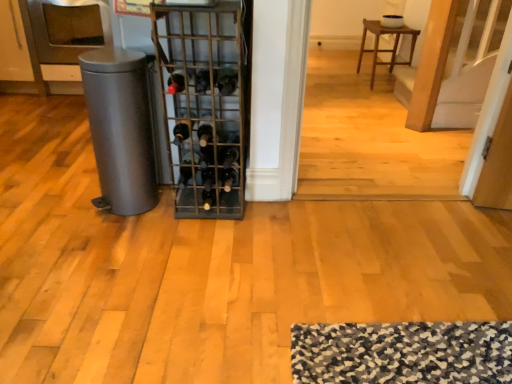
Where is `free area in between metallic wire wine rack at center and matte gray trash can at left`? free area in between metallic wire wine rack at center and matte gray trash can at left is located at coordinates 156,213.